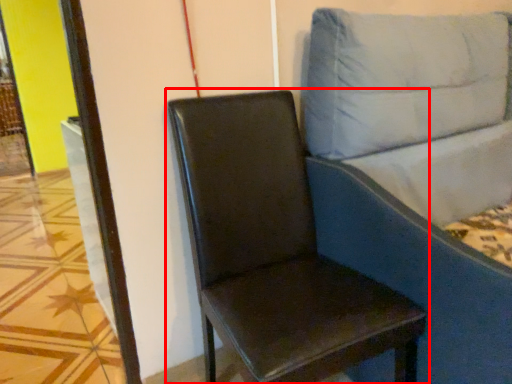
Question: Observing the image, what is the correct spatial positioning of chair (annotated by the red box) in reference to studio couch?

Choices:
 (A) right
 (B) left

Answer: (B)